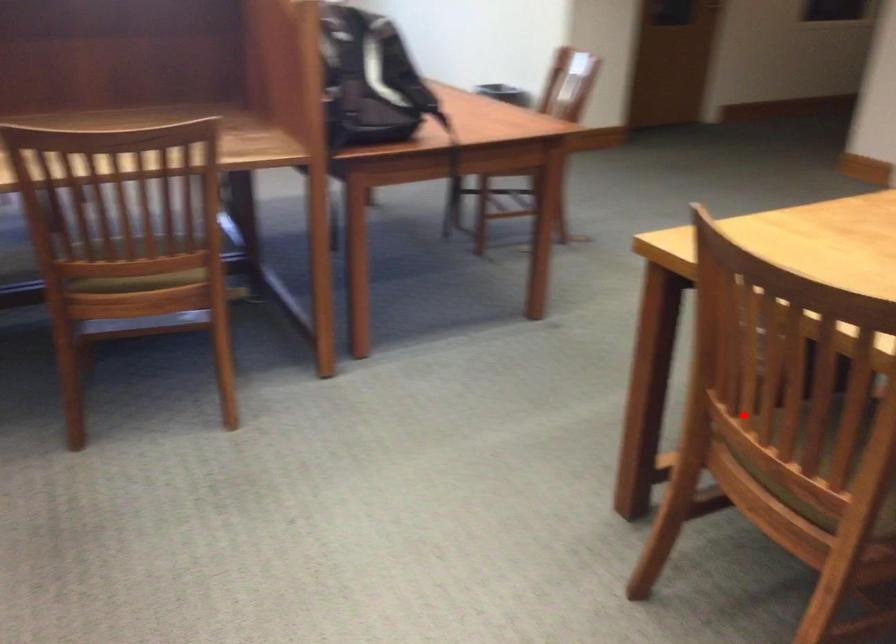
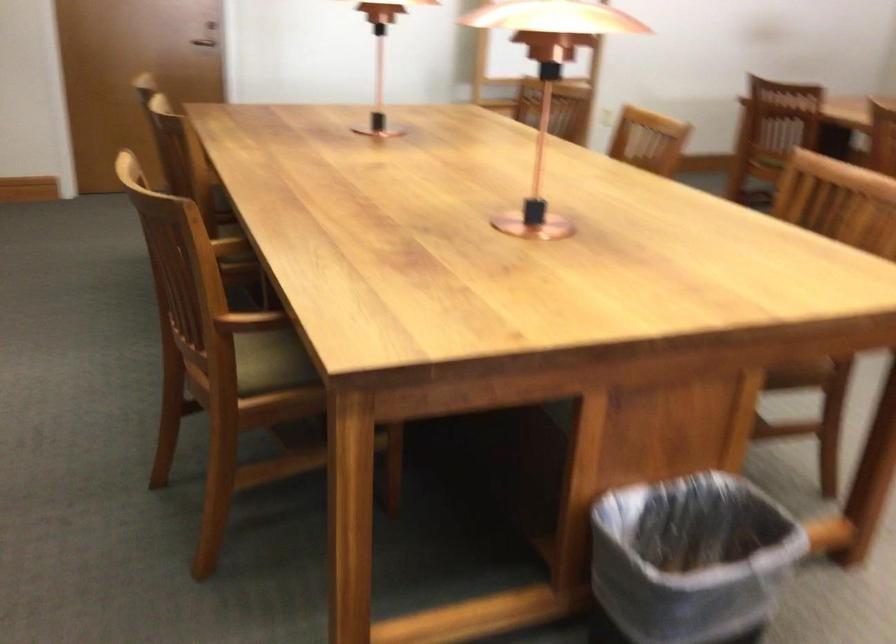
The point at the highlighted location is marked in the first image. Where is the corresponding point in the second image?

(799, 374)